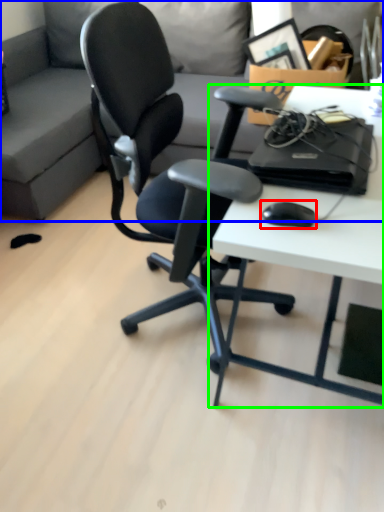
Question: Which is nearer to the mouse (highlighted by a red box)? studio couch (highlighted by a blue box) or desk (highlighted by a green box).

Choices:
 (A) studio couch
 (B) desk

Answer: (B)